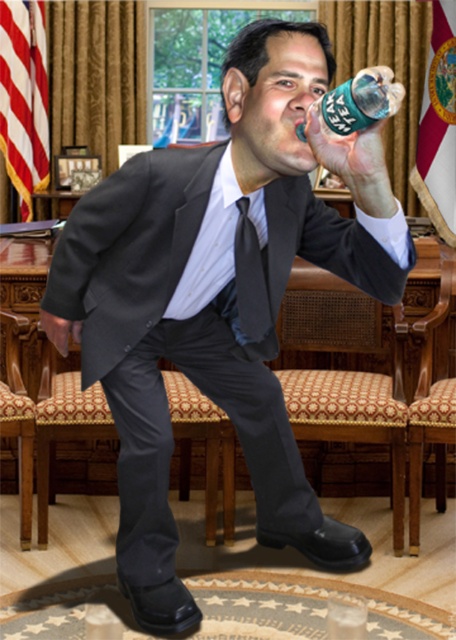
How distant is woven fabric chair at center from patterned fabric chair at lower left?

The distance of woven fabric chair at center from patterned fabric chair at lower left is 1.74 meters.

Identify the location of woven fabric chair at center. (353, 416).

Who is higher up, fabric upholstered chair at center or striped fabric tie at center?

striped fabric tie at center

Who is positioned more to the left, fabric upholstered chair at center or striped fabric tie at center?

Positioned to the left is fabric upholstered chair at center.

What do you see at coordinates (63, 422) in the screenshot? The height and width of the screenshot is (640, 456). I see `fabric upholstered chair at center` at bounding box center [63, 422].

The height and width of the screenshot is (640, 456). In order to click on fabric upholstered chair at center in this screenshot , I will do tap(63, 422).

Does point (376, 326) come farther from viewer compared to point (109, 420)?

That is True.

How distant is woven fabric chair at center from fabric upholstered chair at center?

woven fabric chair at center is 4.59 feet away from fabric upholstered chair at center.

Does point (333, 428) lie in front of point (180, 435)?

Yes, it is.

The width and height of the screenshot is (456, 640). What are the coordinates of `woven fabric chair at center` in the screenshot? It's located at (353, 416).